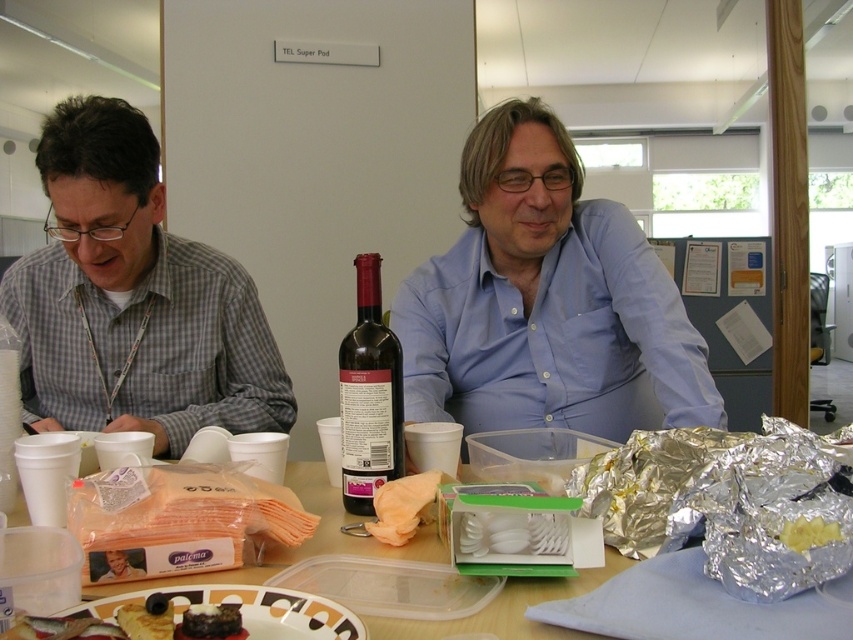
Measure the distance from orange napkins at center to brown crumbly cake at center.

They are 9.79 inches apart.

Between orange napkins at center and brown crumbly cake at center, which one is positioned lower?

Positioned lower is orange napkins at center.

Is point (347, 541) positioned in front of point (228, 627)?

No, it is not.

You are a GUI agent. You are given a task and a screenshot of the screen. Output one action in this format:
    pyautogui.click(x=<x>, y=<y>)
    Task: Click on the orange napkins at center
    This screenshot has height=640, width=853.
    Given the screenshot: What is the action you would take?
    pyautogui.click(x=305, y=541)

Is matte black shirt at left further to camera compared to gray checkered shirt at left?

No, matte black shirt at left is in front of gray checkered shirt at left.

Find the location of a particular element. The image size is (853, 640). matte black shirt at left is located at coordinates (546, 301).

Which is more to the right, gray checkered shirt at left or matte white plate at lower center?

Positioned to the right is matte white plate at lower center.

Does gray checkered shirt at left appear on the left side of matte white plate at lower center?

Correct, you'll find gray checkered shirt at left to the left of matte white plate at lower center.

The height and width of the screenshot is (640, 853). What do you see at coordinates (134, 298) in the screenshot?
I see `gray checkered shirt at left` at bounding box center [134, 298].

In order to click on gray checkered shirt at left in this screenshot , I will do click(x=134, y=298).